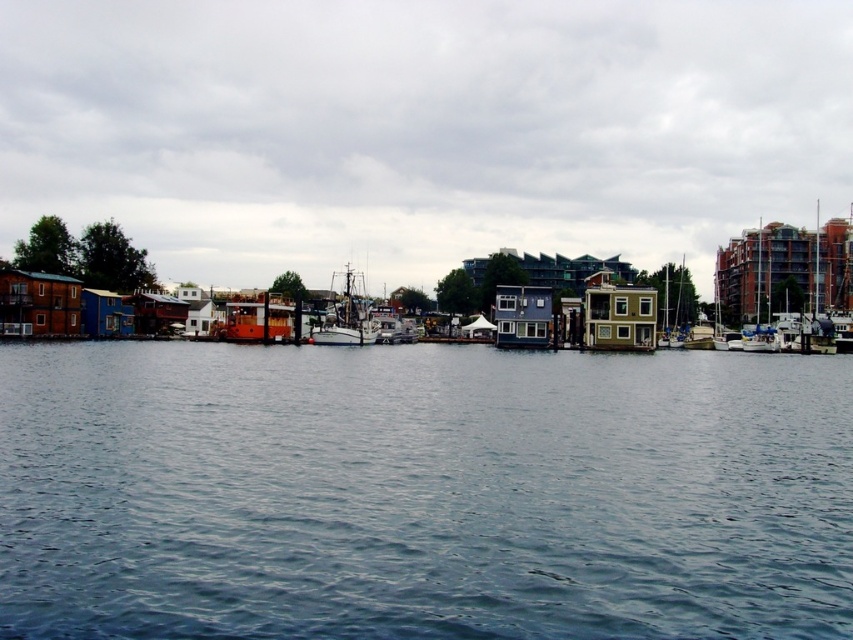
You are standing at the point with coordinates point (352, 273) and want to walk to the point with coordinates point (689, 448). Given the waterfront scene described, will you have to walk through or around the houseboats?

Point (689, 448) is in front of point (352, 273), so you can walk directly to it without needing to go around the houseboats.

You are standing on the wooden ship at center and want to move to the blue water at center. Which direction should you go?

The blue water at center is positioned on the right side of wooden ship at center, so you should go to the right to reach it.